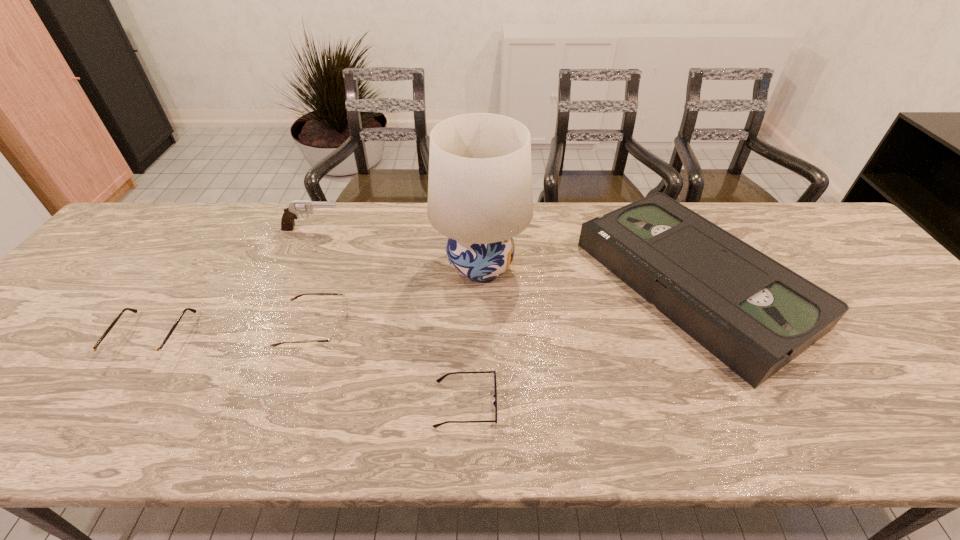
Image resolution: width=960 pixels, height=540 pixels. I want to click on free space at the near edge of the desktop, so click(x=689, y=428).

This screenshot has height=540, width=960. In order to click on vacant space at the left edge in this screenshot , I will do `click(60, 349)`.

Where is `blank space at the right edge of the desktop`? This screenshot has width=960, height=540. blank space at the right edge of the desktop is located at coordinates (850, 309).

In the image, there is a desktop. Identify the location of free space at the far left corner. This screenshot has height=540, width=960. (168, 211).

Identify the location of vacant area that lies between the lampshade and the rightmost object. (587, 275).

Where is `free space that is in between the leftmost spectacles and the rightmost spectacles`? The width and height of the screenshot is (960, 540). free space that is in between the leftmost spectacles and the rightmost spectacles is located at coordinates (309, 371).

This screenshot has width=960, height=540. Find the location of `free space between the fifth shortest object and the lampshade`. free space between the fifth shortest object and the lampshade is located at coordinates (396, 247).

At what (x,y) coordinates should I click in order to perform the action: click on empty space between the gun and the rightmost spectacles. Please return your answer as a coordinate pair (x, y). Looking at the image, I should click on (389, 317).

You are a GUI agent. You are given a task and a screenshot of the screen. Output one action in this format:
    pyautogui.click(x=<x>, y=<y>)
    Task: Click on the free space between the leftmost object and the nearest spectacles
    
    Given the screenshot: What is the action you would take?
    pyautogui.click(x=309, y=371)

At what (x,y) coordinates should I click in order to perform the action: click on free space between the leftmost spectacles and the fourth shortest object. Please return your answer as a coordinate pair (x, y). The height and width of the screenshot is (540, 960). Looking at the image, I should click on (422, 310).